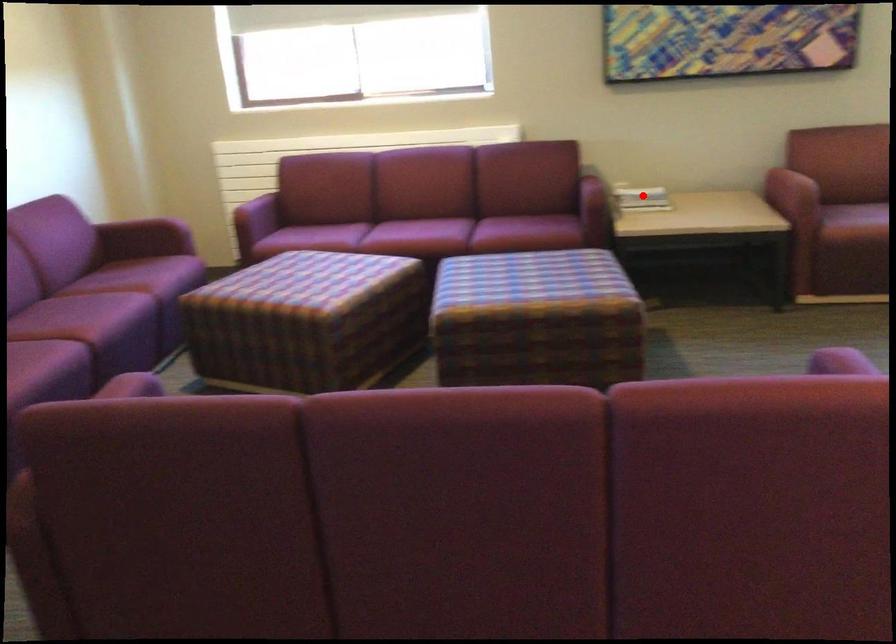
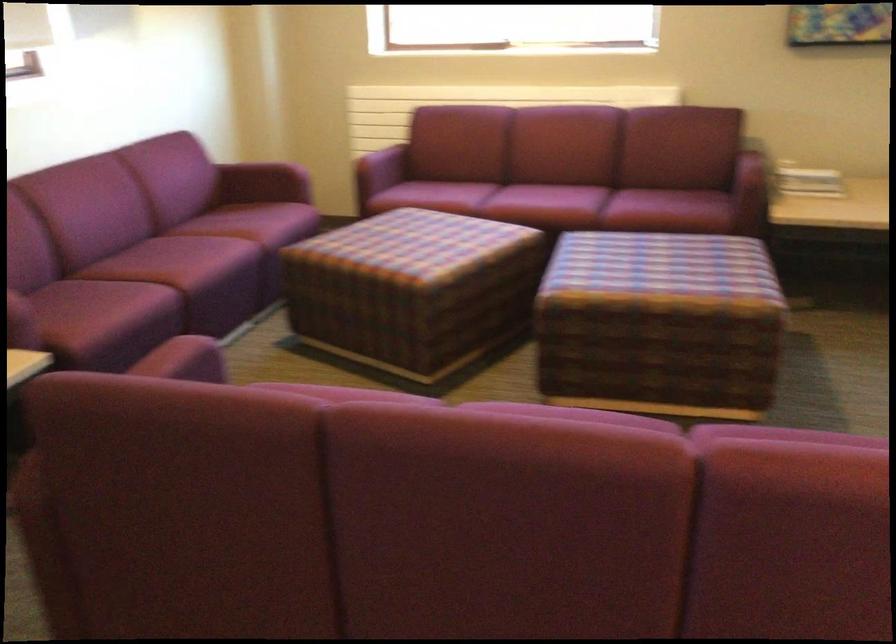
Question: A red point is marked in image1. In image2, is the corresponding 3D point closer to the camera or farther? Reply with the corresponding letter.

Choices:
 (A) The corresponding 3D point is closer.
 (B) The corresponding 3D point is farther.

Answer: (A)